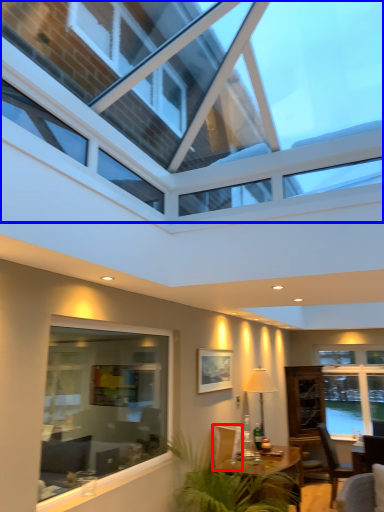
Question: Which object is closer to the camera taking this photo, armchair (highlighted by a red box) or window (highlighted by a blue box)?

Choices:
 (A) armchair
 (B) window

Answer: (B)